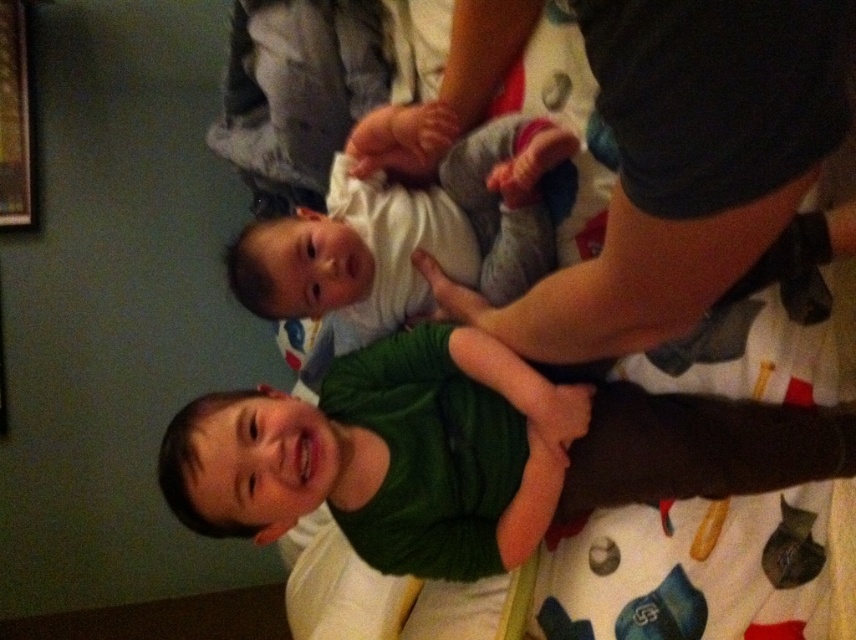
Question: Which object is closer to the camera taking this photo?

Choices:
 (A) white soft baby at center
 (B) green matte shirt at center

Answer: (B)

Question: Is green matte shirt at center closer to the viewer compared to white soft baby at center?

Choices:
 (A) yes
 (B) no

Answer: (A)

Question: Can you confirm if green matte shirt at center is positioned to the left of white soft baby at center?

Choices:
 (A) yes
 (B) no

Answer: (B)

Question: Is green matte shirt at center thinner than white soft baby at center?

Choices:
 (A) no
 (B) yes

Answer: (A)

Question: Among these points, which one is farthest from the camera?

Choices:
 (A) (342, 173)
 (B) (480, 531)

Answer: (A)